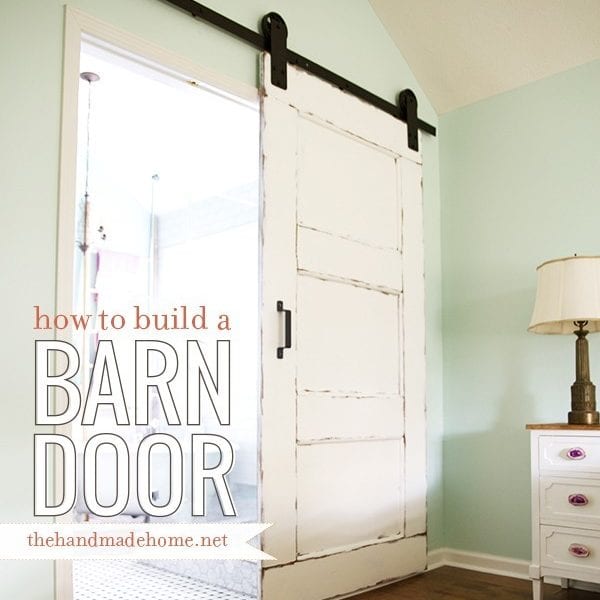
Find the location of a particular element. This screenshot has width=600, height=600. bathroom is located at coordinates (122, 229).